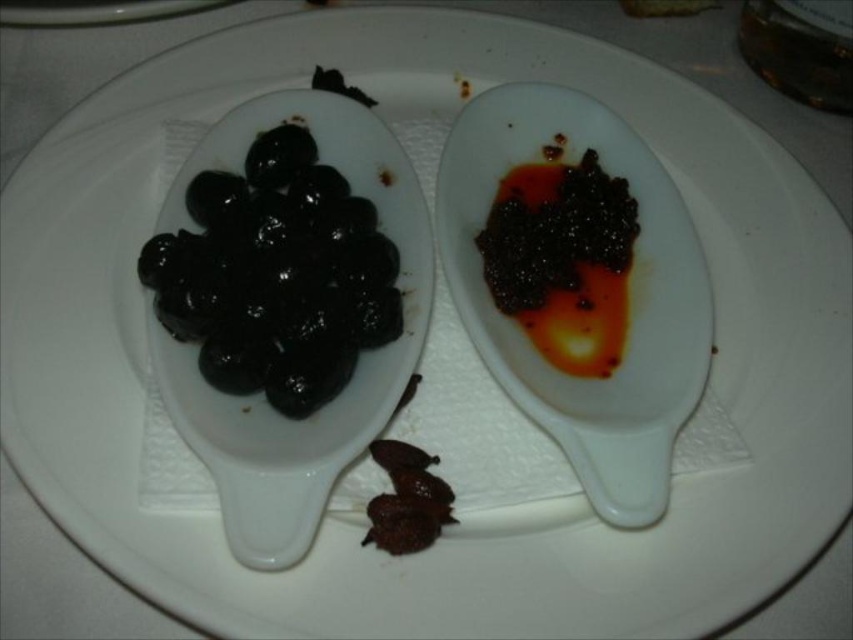
Who is shorter, shiny black caviar at right or shiny brown olives at lower center?

shiny brown olives at lower center

Can you confirm if shiny black caviar at right is positioned above shiny brown olives at lower center?

Correct, shiny black caviar at right is located above shiny brown olives at lower center.

Image resolution: width=853 pixels, height=640 pixels. What do you see at coordinates (563, 260) in the screenshot?
I see `shiny black caviar at right` at bounding box center [563, 260].

Find the location of a particular element. shiny black caviar at right is located at coordinates (563, 260).

In order to click on white glossy spoon at upper right in this screenshot , I will do `click(633, 316)`.

What do you see at coordinates (633, 316) in the screenshot?
I see `white glossy spoon at upper right` at bounding box center [633, 316].

You are a GUI agent. You are given a task and a screenshot of the screen. Output one action in this format:
    pyautogui.click(x=<x>, y=<y>)
    Task: Click on the white glossy spoon at upper right
    
    Given the screenshot: What is the action you would take?
    pyautogui.click(x=633, y=316)

From the picture: Can you confirm if black glossy olives at left is positioned to the left of shiny brown olives at lower center?

Correct, you'll find black glossy olives at left to the left of shiny brown olives at lower center.

Locate an element on the screen. The width and height of the screenshot is (853, 640). black glossy olives at left is located at coordinates (276, 276).